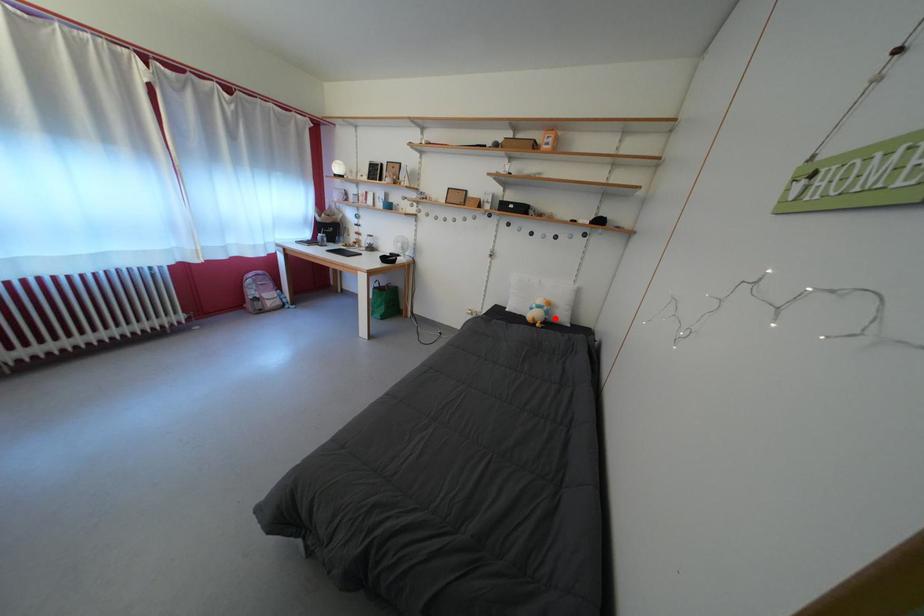
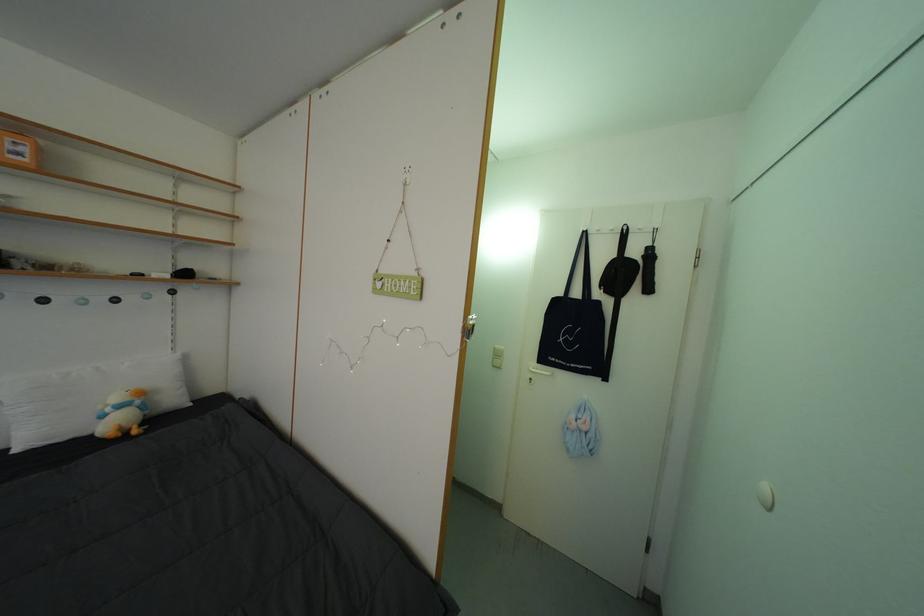
Find the pixel in the second image that matches the highlighted location in the first image.

(152, 413)